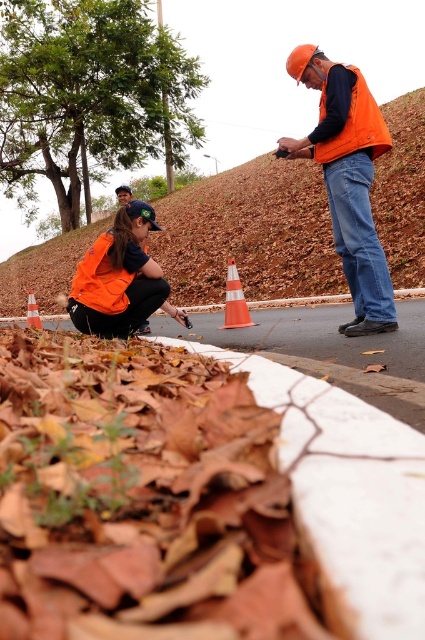
Can you confirm if white concrete curb at lower center is positioned above orange plastic traffic cone at lower left?

Yes, white concrete curb at lower center is above orange plastic traffic cone at lower left.

Is point (263, 305) positioned in front of point (25, 321)?

Yes, point (263, 305) is in front of point (25, 321).

Between point (59, 314) and point (34, 326), which one is positioned in front?

Point (34, 326)

This screenshot has height=640, width=425. I want to click on white concrete curb at lower center, so click(x=300, y=301).

Measure the distance between brown dirt at upper center and orange reflective vest at upper right.

A distance of 13.43 meters exists between brown dirt at upper center and orange reflective vest at upper right.

Between brown dirt at upper center and orange reflective vest at upper right, which one is positioned higher?

brown dirt at upper center is higher up.

Who is more forward, (8, 310) or (300, 145)?

Point (300, 145) is in front.

This screenshot has width=425, height=640. What are the coordinates of `brown dirt at upper center` in the screenshot? It's located at (249, 234).

Does brown dirt at upper center have a lesser height compared to orange matte safety vest at lower left?

Incorrect, brown dirt at upper center's height does not fall short of orange matte safety vest at lower left's.

Does brown dirt at upper center appear on the right side of orange matte safety vest at lower left?

Incorrect, brown dirt at upper center is not on the right side of orange matte safety vest at lower left.

The image size is (425, 640). Identify the location of brown dirt at upper center. (249, 234).

This screenshot has height=640, width=425. What are the coordinates of `brown dirt at upper center` in the screenshot? It's located at (249, 234).